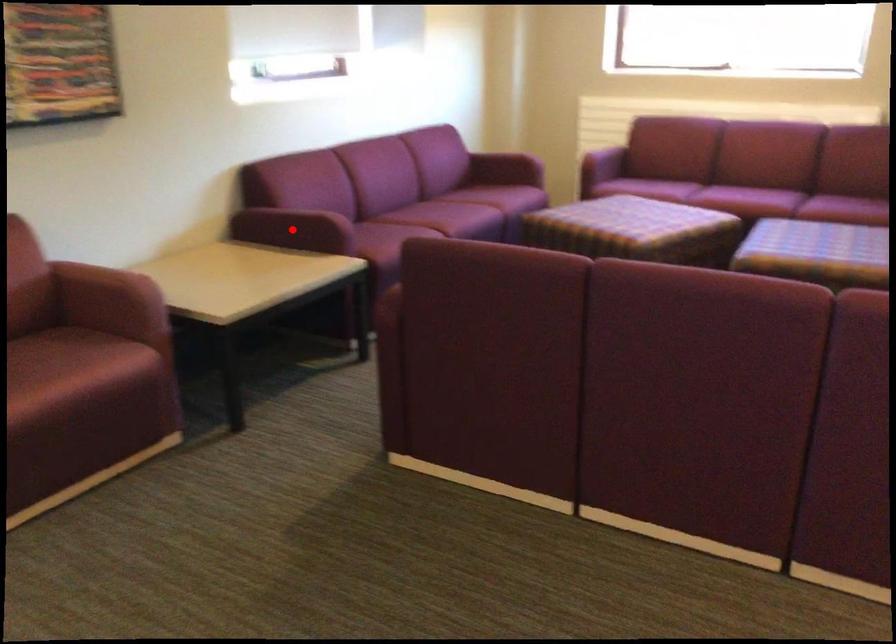
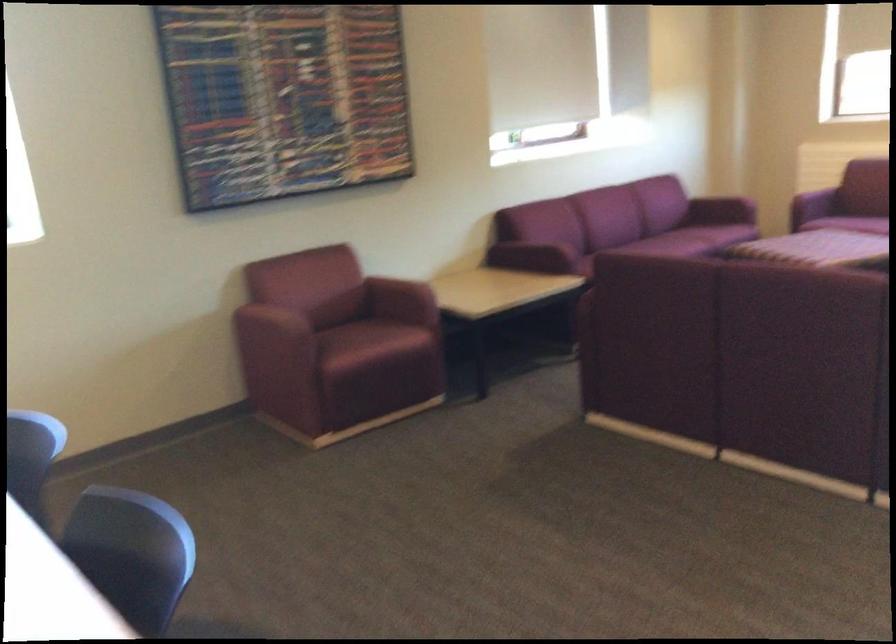
Question: I am providing you with two images of the same scene from different viewpoints. Image1 has a red point marked. In image2, the corresponding 3D location appears at what relative position? Reply with the corresponding letter.

Choices:
 (A) Closer
 (B) Farther

Answer: (B)